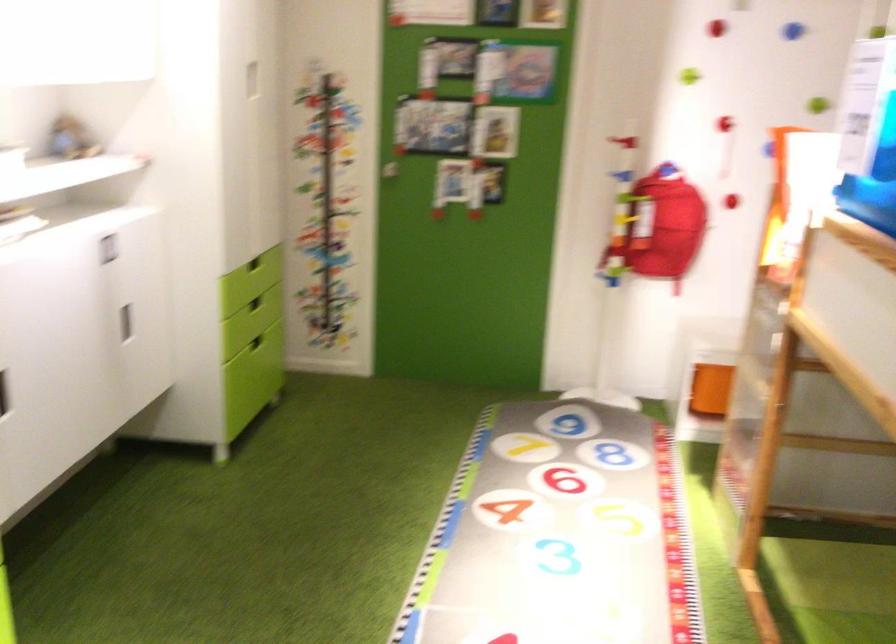
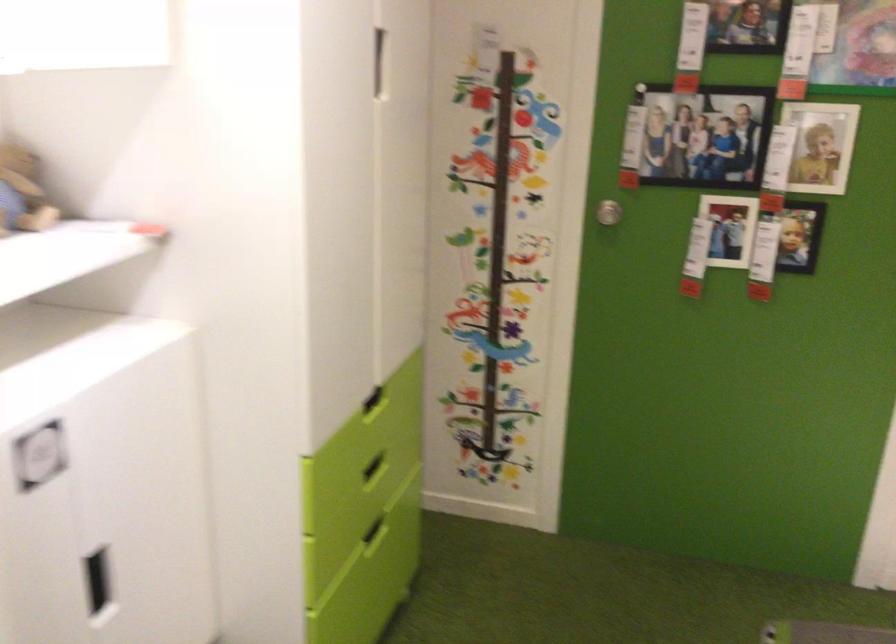
The point at (82, 140) is marked in the first image. Where is the corresponding point in the second image?

(22, 192)